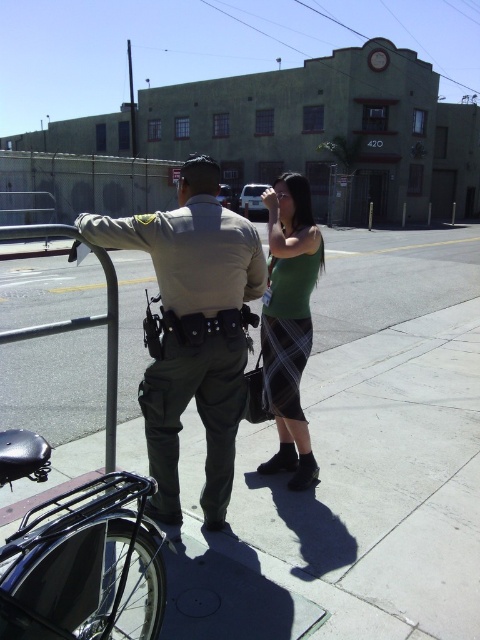
What is located at the point with coordinates (358,465) in the image?

The gray concrete sidewalk at center is located at point (358,465).

You are a pedestrian trying to cross the street. You see the gray concrete sidewalk at center and the green plaid skirt at center. Which object is closer to you?

The gray concrete sidewalk at center is closer to the viewer than the green plaid skirt at center.

You are a delivery person trying to walk on the gray concrete sidewalk at center while avoiding stepping on the matte khaki uniform at center. Is it possible to do so?

The gray concrete sidewalk at center is positioned over matte khaki uniform at center, so yes, you can walk on the gray concrete sidewalk at center without stepping on the matte khaki uniform at center.